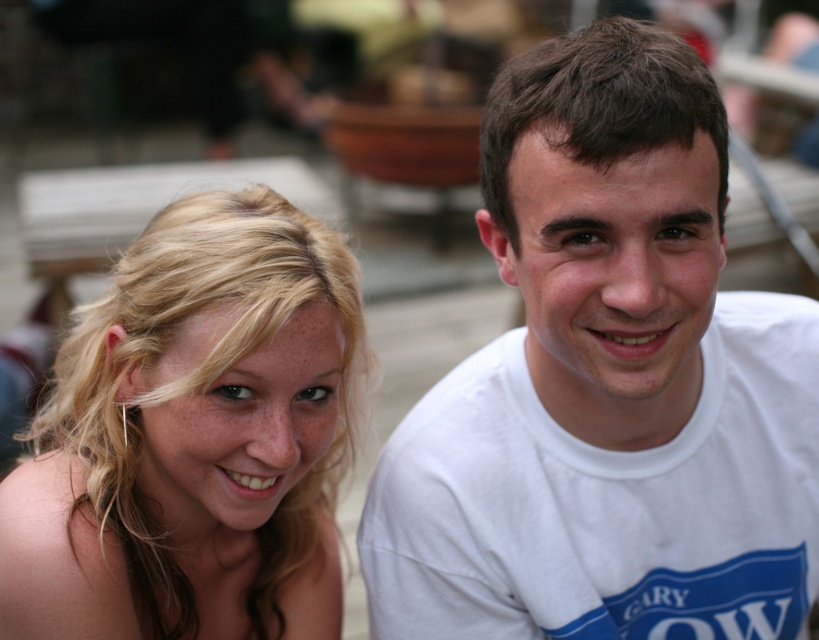
Question: Can you confirm if white cotton t-shirt at upper right is smaller than blonde hair at left?

Choices:
 (A) yes
 (B) no

Answer: (B)

Question: From the image, what is the correct spatial relationship of white cotton t-shirt at upper right in relation to blonde hair at left?

Choices:
 (A) below
 (B) above

Answer: (B)

Question: Can you confirm if white cotton t-shirt at upper right is positioned to the left of blonde hair at left?

Choices:
 (A) yes
 (B) no

Answer: (B)

Question: Which of the following is the closest to the observer?

Choices:
 (A) (143, 317)
 (B) (777, 401)

Answer: (A)

Question: Which of the following is the farthest from the observer?

Choices:
 (A) blonde hair at left
 (B) white cotton t-shirt at upper right

Answer: (A)

Question: Which of the following is the closest to the observer?

Choices:
 (A) blonde hair at left
 (B) white cotton t-shirt at upper right

Answer: (B)